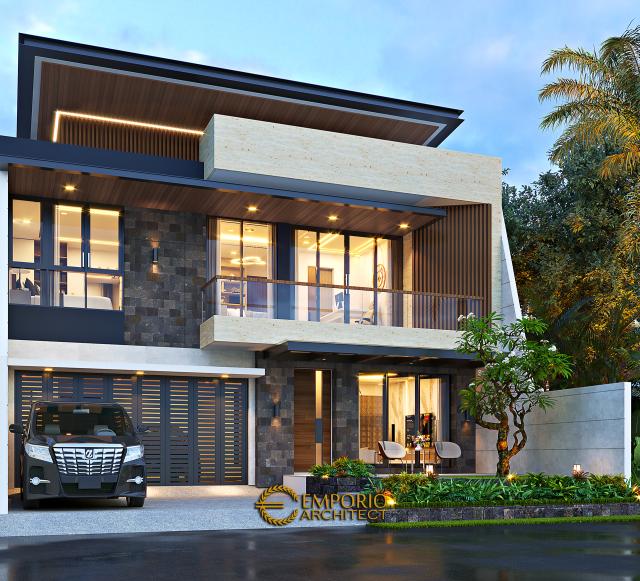
Image resolution: width=640 pixels, height=581 pixels. I want to click on windows, so click(248, 261), click(336, 267), click(388, 268), click(109, 256), click(32, 243), click(413, 413).